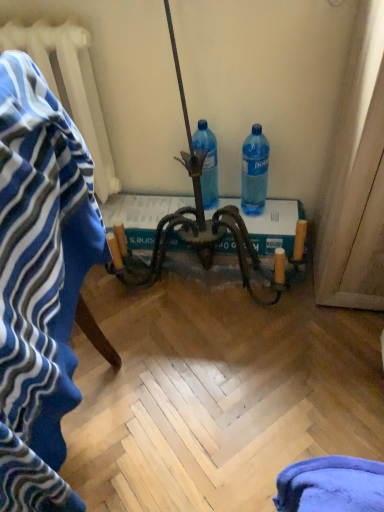
Question: Is blue plastic bottle at center, which is the 2th bottle from right to left, inside the boundaries of white textured radiator at upper left, or outside?

Choices:
 (A) outside
 (B) inside

Answer: (A)

Question: In terms of width, does blue plastic bottle at center, which is the 2th bottle from right to left, look wider or thinner when compared to white textured radiator at upper left?

Choices:
 (A) wide
 (B) thin

Answer: (B)

Question: Which object is the farthest from the transparent plastic bottle at right, positioned as the first bottle in right-to-left order?

Choices:
 (A) white textured radiator at upper left
 (B) blue plastic bottle at center, which is counted as the first bottle, starting from the left
 (C) blue striped bath towel at left

Answer: (C)

Question: Estimate the real-world distances between objects in this image. Which object is closer to the blue plastic bottle at center, which is the 2th bottle from right to left?

Choices:
 (A) white textured radiator at upper left
 (B) blue striped bath towel at left
 (C) transparent plastic bottle at right, the 2th bottle viewed from the left

Answer: (C)